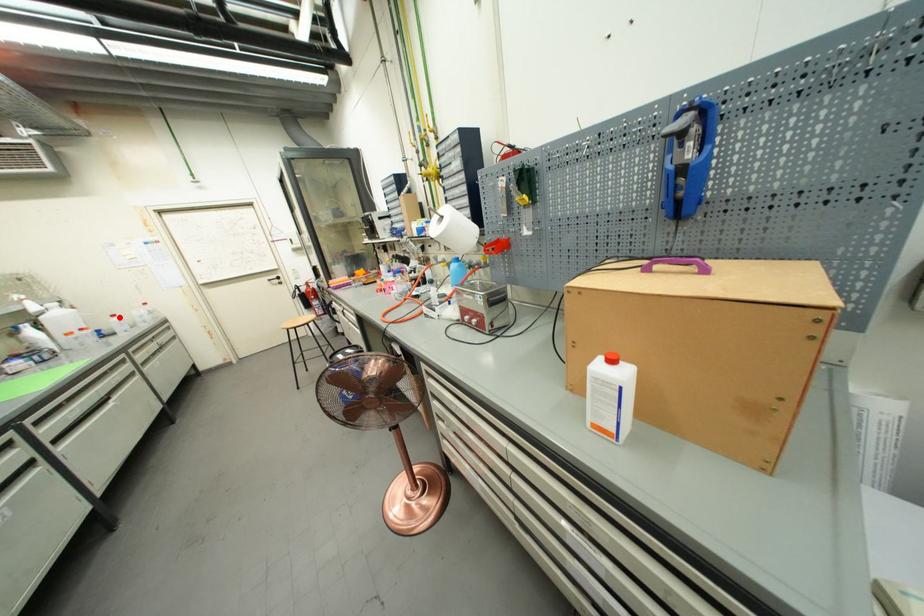
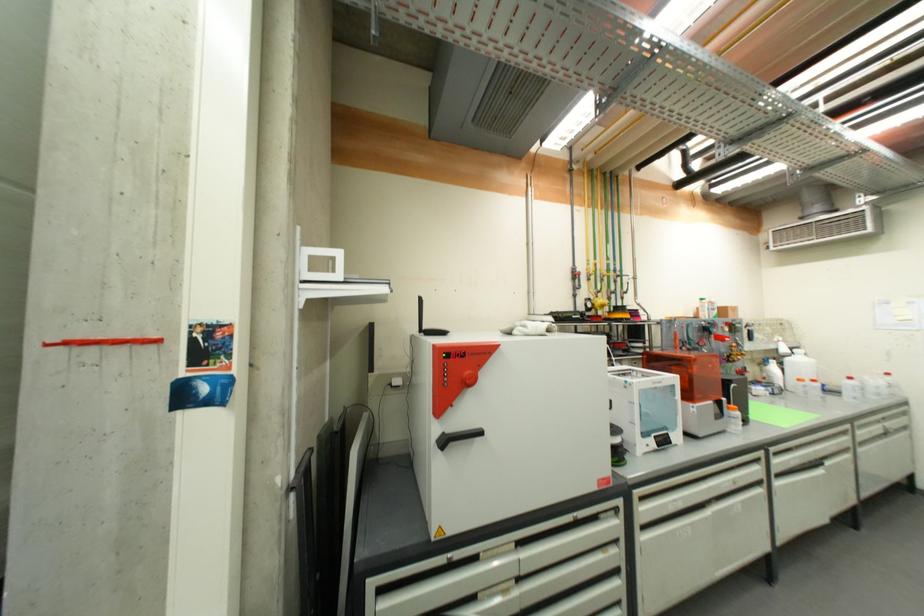
Question: I am providing you with two images of the same scene from different viewpoints. Given a red point in image1, look at the same physical point in image2. Is it:

Choices:
 (A) Closer to the viewpoint
 (B) Farther from the viewpoint

Answer: (A)